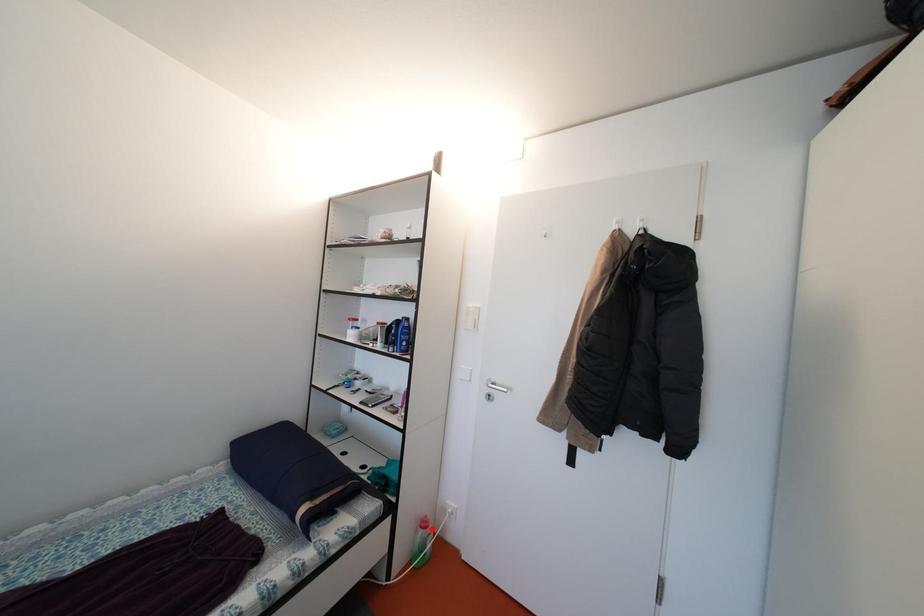
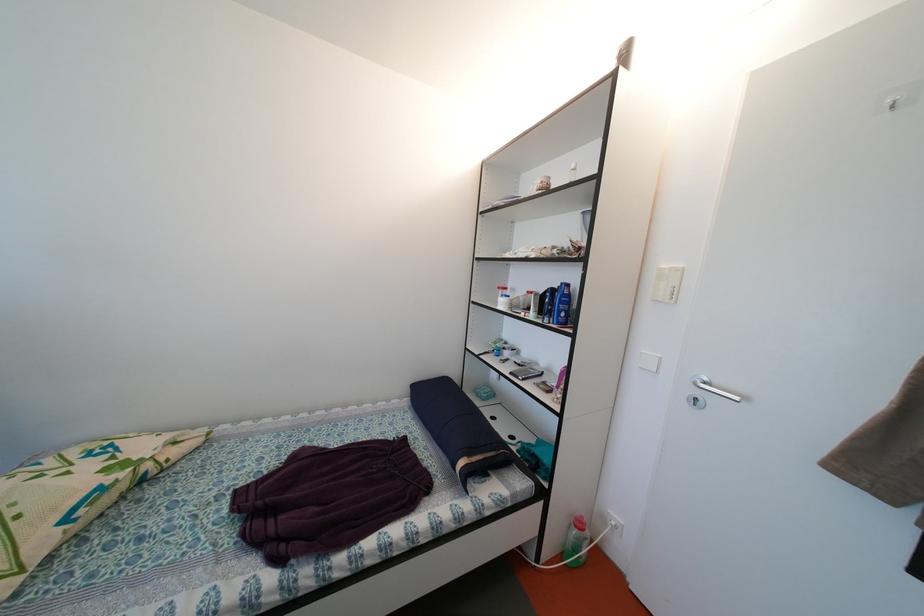
The point at the highlighted location is marked in the first image. Where is the corresponding point in the second image?

(587, 530)